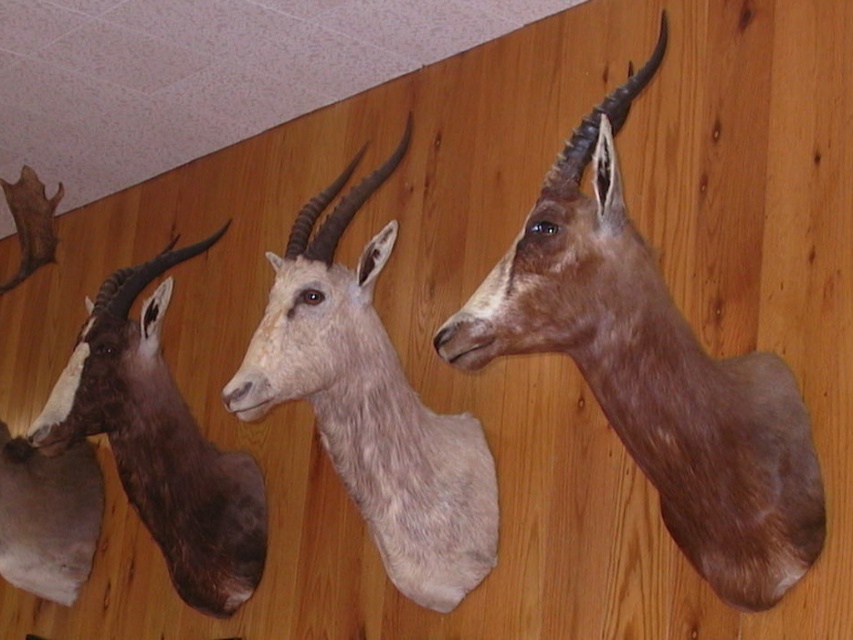
Question: Does brown matte antelope head at center have a greater width compared to brown matte antelope at left?

Choices:
 (A) no
 (B) yes

Answer: (B)

Question: Which point appears farthest from the camera in this image?

Choices:
 (A) (737, 394)
 (B) (45, 432)

Answer: (B)

Question: Among these points, which one is nearest to the camera?

Choices:
 (A) (631, 413)
 (B) (206, 570)

Answer: (A)

Question: Can you confirm if white matte antelope head at center is thinner than brown matte antelope at left?

Choices:
 (A) yes
 (B) no

Answer: (B)

Question: Among these objects, which one is farthest from the camera?

Choices:
 (A) brown matte antelope head at center
 (B) brown matte antelope at left

Answer: (B)

Question: Is brown matte antelope head at center bigger than brown matte antelope at left?

Choices:
 (A) yes
 (B) no

Answer: (B)